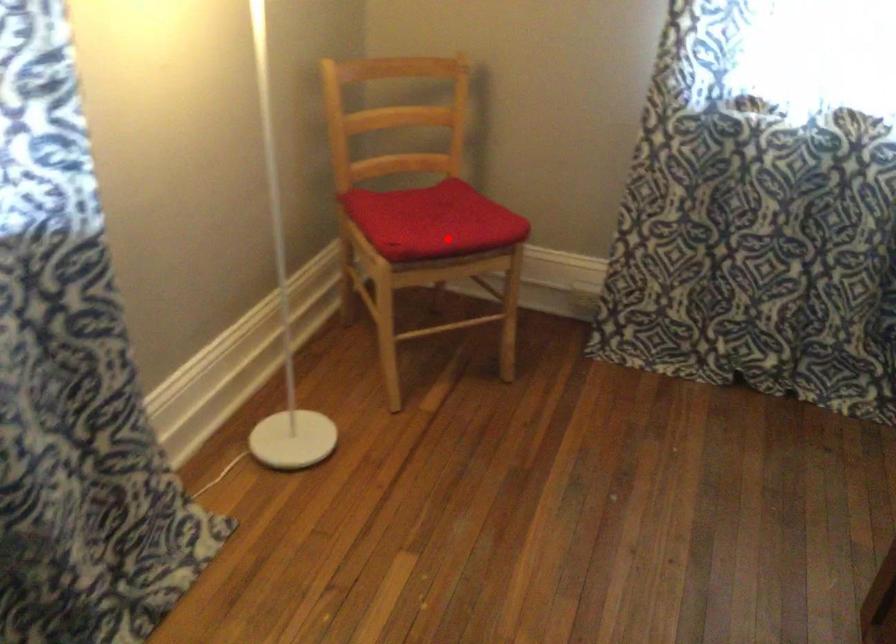
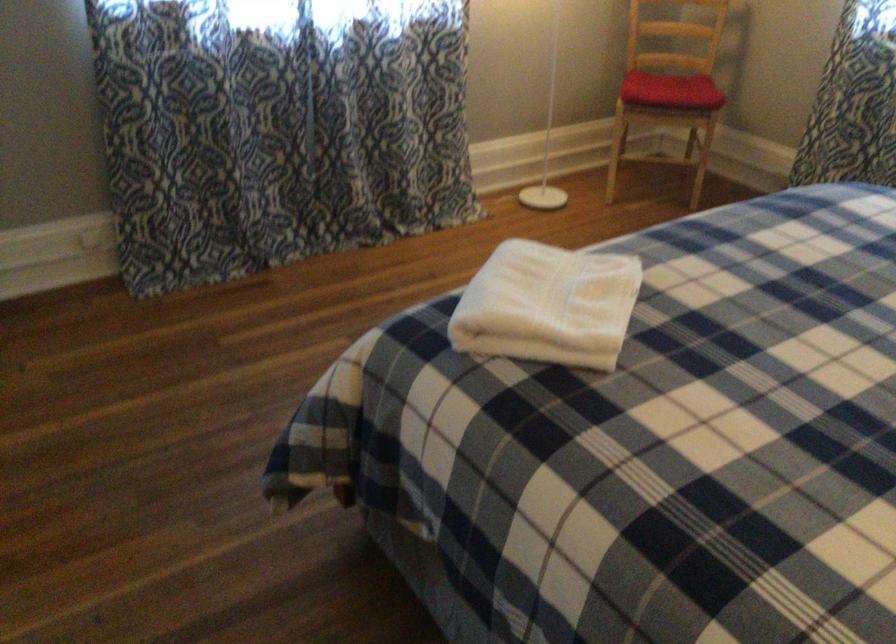
Find the pixel in the second image that matches the highlighted location in the first image.

(670, 90)